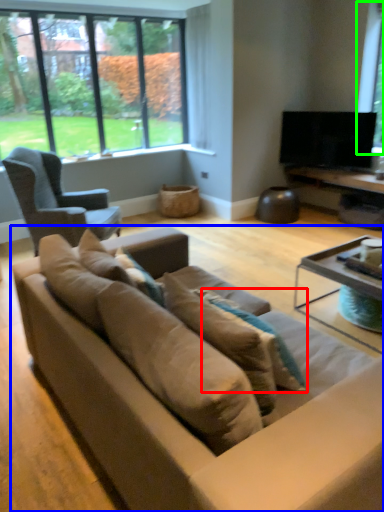
Question: Based on their relative distances, which object is nearer to pillow (highlighted by a red box)? Choose from studio couch (highlighted by a blue box) and window screen (highlighted by a green box).

Choices:
 (A) studio couch
 (B) window screen

Answer: (A)